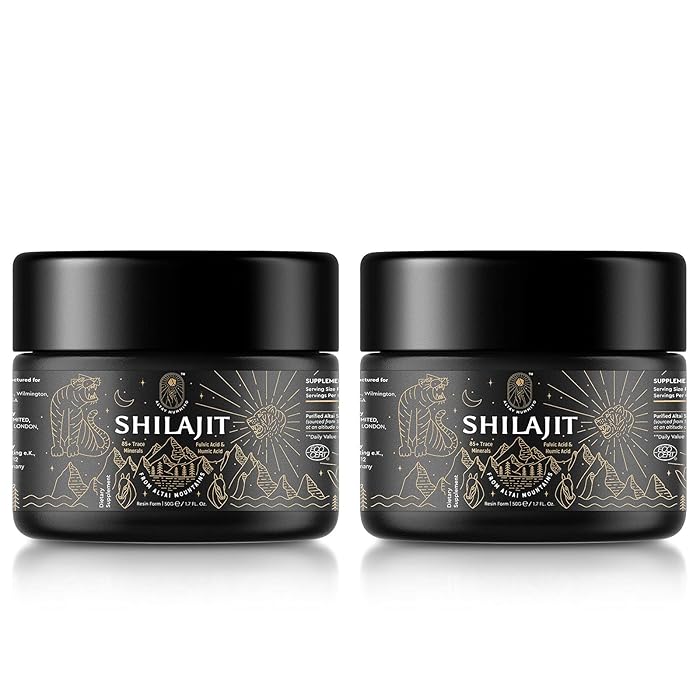
What are the coordinates of `black jars` in the screenshot? It's located at (475, 533), (281, 528).